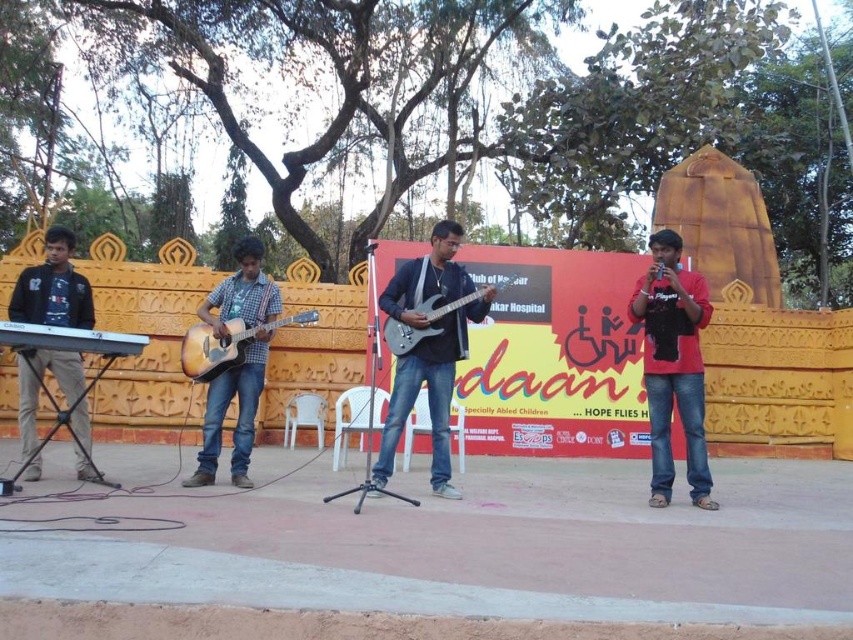
Does concrete stage at center have a larger size compared to white plastic keyboard at left?

Incorrect, concrete stage at center is not larger than white plastic keyboard at left.

Does point (424, 492) lie behind point (12, 333)?

Yes, it is.

The height and width of the screenshot is (640, 853). What do you see at coordinates (479, 547) in the screenshot?
I see `concrete stage at center` at bounding box center [479, 547].

Image resolution: width=853 pixels, height=640 pixels. Identify the location of concrete stage at center. (479, 547).

The image size is (853, 640). In order to click on metallic silver guitar at center in this screenshot , I will do `click(428, 392)`.

Can you confirm if metallic silver guitar at center is shorter than natural wood acoustic guitar at center?

In fact, metallic silver guitar at center may be taller than natural wood acoustic guitar at center.

Is point (437, 342) less distant than point (213, 371)?

Yes, it is.

I want to click on metallic silver guitar at center, so click(x=428, y=392).

Which of these two, wooden acoustic guitar at center or white plastic keyboard at left, stands taller?

wooden acoustic guitar at center

What do you see at coordinates (239, 364) in the screenshot? I see `wooden acoustic guitar at center` at bounding box center [239, 364].

You are a GUI agent. You are given a task and a screenshot of the screen. Output one action in this format:
    pyautogui.click(x=<x>, y=<y>)
    Task: Click on the wooden acoustic guitar at center
    The height and width of the screenshot is (640, 853).
    Given the screenshot: What is the action you would take?
    pyautogui.click(x=239, y=364)